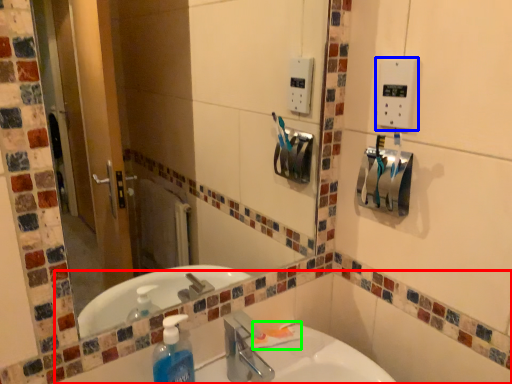
Question: Based on their relative distances, which object is nearer to bath (highlighted by a red box)? Choose from light switch (highlighted by a blue box) and toothpaste (highlighted by a green box).

Choices:
 (A) light switch
 (B) toothpaste

Answer: (B)